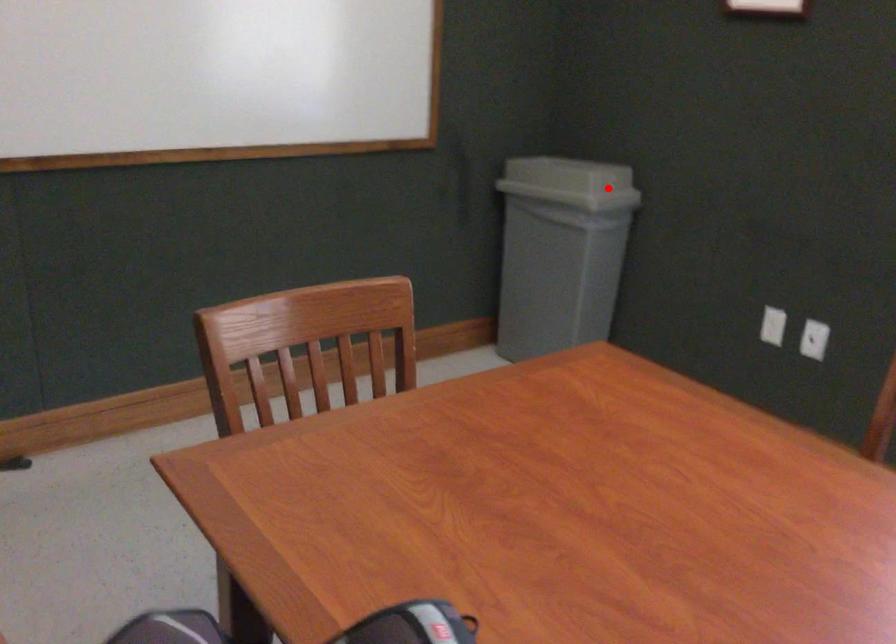
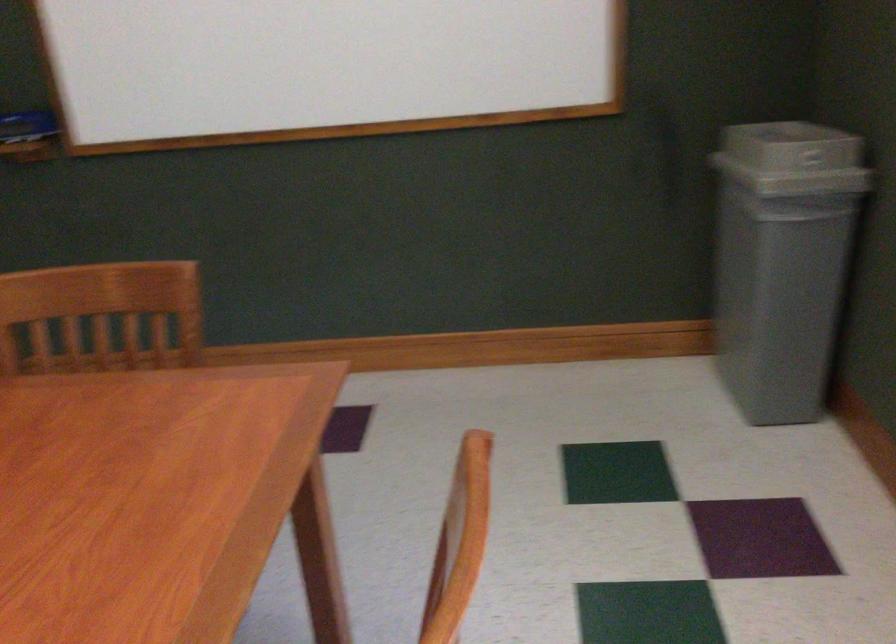
Question: I am providing you with two images of the same scene from different viewpoints. A red point is marked on the first image. At the location where the point appears in image 1, is it still visible in image 2?

Choices:
 (A) Yes
 (B) No

Answer: (A)